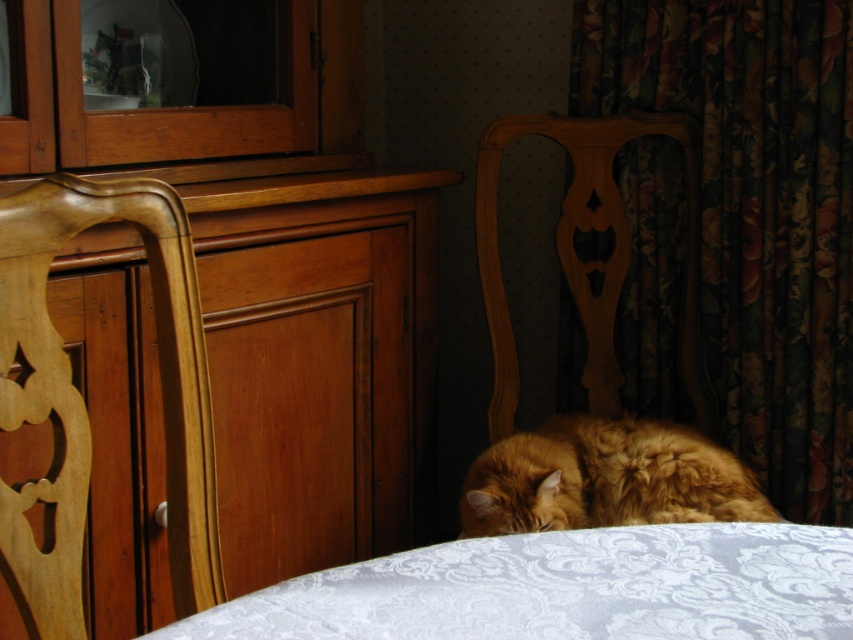
Who is shorter, floral fabric curtain at right or white damask fabric at lower center?

With less height is white damask fabric at lower center.

Who is taller, floral fabric curtain at right or white damask fabric at lower center?

With more height is floral fabric curtain at right.

Which is in front, point (820, 408) or point (692, 577)?

Positioned in front is point (692, 577).

Where is `floral fabric curtain at right`? Image resolution: width=853 pixels, height=640 pixels. floral fabric curtain at right is located at coordinates (755, 211).

Which is below, wooden carved chair at left or orange fluffy cat at lower center?

Positioned lower is orange fluffy cat at lower center.

Which is above, wooden carved chair at left or orange fluffy cat at lower center?

wooden carved chair at left is higher up.

Is point (190, 541) closer to viewer compared to point (610, 442)?

Yes, point (190, 541) is in front of point (610, 442).

Locate an element on the screen. This screenshot has width=853, height=640. wooden carved chair at left is located at coordinates (84, 403).

Is wooden chair at center in front of orange fluffy cat at lower center?

No.

Who is shorter, wooden chair at center or orange fluffy cat at lower center?

With less height is orange fluffy cat at lower center.

Is point (711, 420) positioned before point (706, 460)?

No, (711, 420) is further to viewer.

You are a GUI agent. You are given a task and a screenshot of the screen. Output one action in this format:
    pyautogui.click(x=<x>, y=<y>)
    Task: Click on the wooden chair at center
    This screenshot has height=640, width=853.
    Given the screenshot: What is the action you would take?
    pyautogui.click(x=589, y=259)